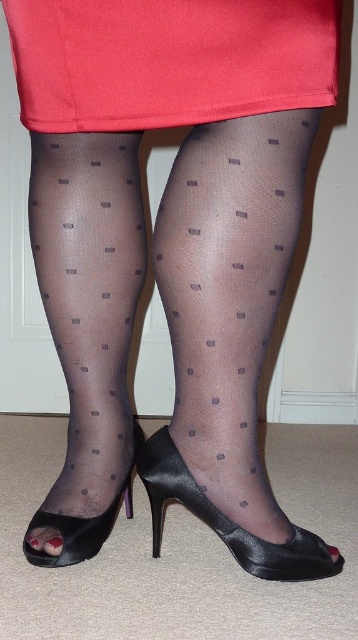
Question: Which point is closer to the camera?

Choices:
 (A) sheer polka dot tights at center
 (B) matte red fabric at center
 (C) black satin shoe at lower center

Answer: (B)

Question: Does sheer polka dot tights at center appear over sheer black tights at lower left?

Choices:
 (A) no
 (B) yes

Answer: (A)

Question: Which point is closer to the camera taking this photo?

Choices:
 (A) (239, 548)
 (B) (230, 230)
 (C) (94, 529)

Answer: (B)

Question: Can you confirm if matte red fabric at center is thinner than sheer black tights at lower left?

Choices:
 (A) no
 (B) yes

Answer: (A)

Question: Is matte red fabric at center behind black satin peep-toe shoe at lower center?

Choices:
 (A) yes
 (B) no

Answer: (B)

Question: Which point is farther from the camera taking this photo?

Choices:
 (A) (37, 552)
 (B) (84, 104)
 (C) (238, 321)

Answer: (A)